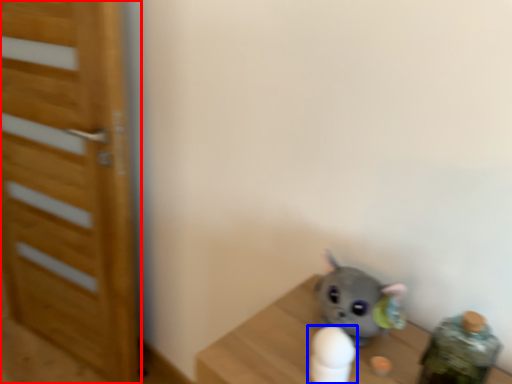
Question: Which object is further to the camera taking this photo, door (highlighted by a red box) or toy (highlighted by a blue box)?

Choices:
 (A) door
 (B) toy

Answer: (A)